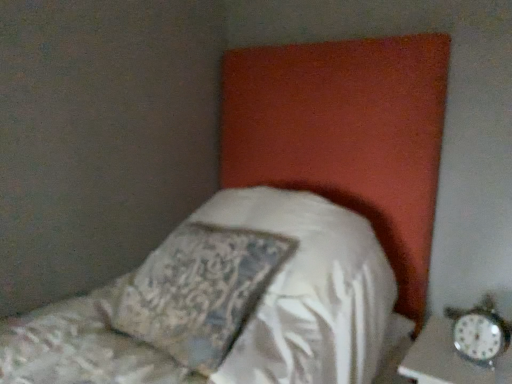
This screenshot has height=384, width=512. I want to click on metallic silver alarm clock at lower right, so click(480, 332).

The image size is (512, 384). What do you see at coordinates (480, 332) in the screenshot?
I see `metallic silver alarm clock at lower right` at bounding box center [480, 332].

Measure the distance between metallic silver alarm clock at lower right and camera.

metallic silver alarm clock at lower right and camera are 1.10 meters apart.

Where is `silky white pillow at center`? This screenshot has height=384, width=512. silky white pillow at center is located at coordinates (199, 291).

Describe the element at coordinates (199, 291) in the screenshot. I see `silky white pillow at center` at that location.

The width and height of the screenshot is (512, 384). Find the location of `metallic silver alarm clock at lower right`. metallic silver alarm clock at lower right is located at coordinates (480, 332).

Consider the image. Visually, is metallic silver alarm clock at lower right positioned to the left or to the right of silky white pillow at center?

From the image, it's evident that metallic silver alarm clock at lower right is to the right of silky white pillow at center.

Between metallic silver alarm clock at lower right and silky white pillow at center, which one is positioned in front?

silky white pillow at center is closer to the camera.

Does point (455, 332) come behind point (165, 266)?

That is False.

From the image's perspective, which is below, metallic silver alarm clock at lower right or silky white pillow at center?

metallic silver alarm clock at lower right is shown below in the image.

From a real-world perspective, is metallic silver alarm clock at lower right located beneath silky white pillow at center?

Indeed, from a real-world perspective, metallic silver alarm clock at lower right is positioned beneath silky white pillow at center.

Is metallic silver alarm clock at lower right wider than silky white pillow at center?

Incorrect, the width of metallic silver alarm clock at lower right does not surpass that of silky white pillow at center.

Can you confirm if metallic silver alarm clock at lower right is taller than silky white pillow at center?

In fact, metallic silver alarm clock at lower right may be shorter than silky white pillow at center.

Is metallic silver alarm clock at lower right bigger than silky white pillow at center?

No.

Is silky white pillow at center located within metallic silver alarm clock at lower right?

Actually, silky white pillow at center is outside metallic silver alarm clock at lower right.

Is metallic silver alarm clock at lower right placed right next to silky white pillow at center?

No, metallic silver alarm clock at lower right is not in contact with silky white pillow at center.

Is metallic silver alarm clock at lower right positioned with its back to silky white pillow at center?

metallic silver alarm clock at lower right does not have its back to silky white pillow at center.

Where is `pillow on the left of metallic silver alarm clock at lower right`? pillow on the left of metallic silver alarm clock at lower right is located at coordinates (199, 291).

Which is more to the left, silky white pillow at center or metallic silver alarm clock at lower right?

From the viewer's perspective, silky white pillow at center appears more on the left side.

Considering their positions, is silky white pillow at center located in front of or behind metallic silver alarm clock at lower right?

In the image, silky white pillow at center appears in front of metallic silver alarm clock at lower right.

Which point is more distant from viewer, (194, 278) or (461, 325)?

Positioned behind is point (461, 325).

From the image's perspective, would you say silky white pillow at center is shown under metallic silver alarm clock at lower right?

No, from the image's perspective, silky white pillow at center is not beneath metallic silver alarm clock at lower right.

From a real-world perspective, is silky white pillow at center above or below metallic silver alarm clock at lower right?

silky white pillow at center is situated higher than metallic silver alarm clock at lower right in the real world.

In terms of width, does silky white pillow at center look wider or thinner when compared to metallic silver alarm clock at lower right?

Clearly, silky white pillow at center has more width compared to metallic silver alarm clock at lower right.

Which of these two, silky white pillow at center or metallic silver alarm clock at lower right, stands taller?

silky white pillow at center.

Is silky white pillow at center smaller than metallic silver alarm clock at lower right?

No.

Based on the photo, is silky white pillow at center inside or outside of metallic silver alarm clock at lower right?

silky white pillow at center is outside metallic silver alarm clock at lower right.

Is silky white pillow at center next to metallic silver alarm clock at lower right?

No, silky white pillow at center is not in contact with metallic silver alarm clock at lower right.

Could you tell me if silky white pillow at center is facing metallic silver alarm clock at lower right?

No, silky white pillow at center does not turn towards metallic silver alarm clock at lower right.

What's the angular difference between silky white pillow at center and metallic silver alarm clock at lower right's facing directions?

silky white pillow at center and metallic silver alarm clock at lower right are facing 9.91 degrees away from each other.

Measure the distance between silky white pillow at center and metallic silver alarm clock at lower right.

silky white pillow at center is 26.60 inches from metallic silver alarm clock at lower right.

At what (x,y) coordinates should I click in order to perform the action: click on pillow above the metallic silver alarm clock at lower right (from a real-world perspective). Please return your answer as a coordinate pair (x, y). The height and width of the screenshot is (384, 512). Looking at the image, I should click on (199, 291).

Where is `alarm clock on the right side of silky white pillow at center`? alarm clock on the right side of silky white pillow at center is located at coordinates (480, 332).

This screenshot has height=384, width=512. Identify the location of pillow above the metallic silver alarm clock at lower right (from a real-world perspective). (199, 291).